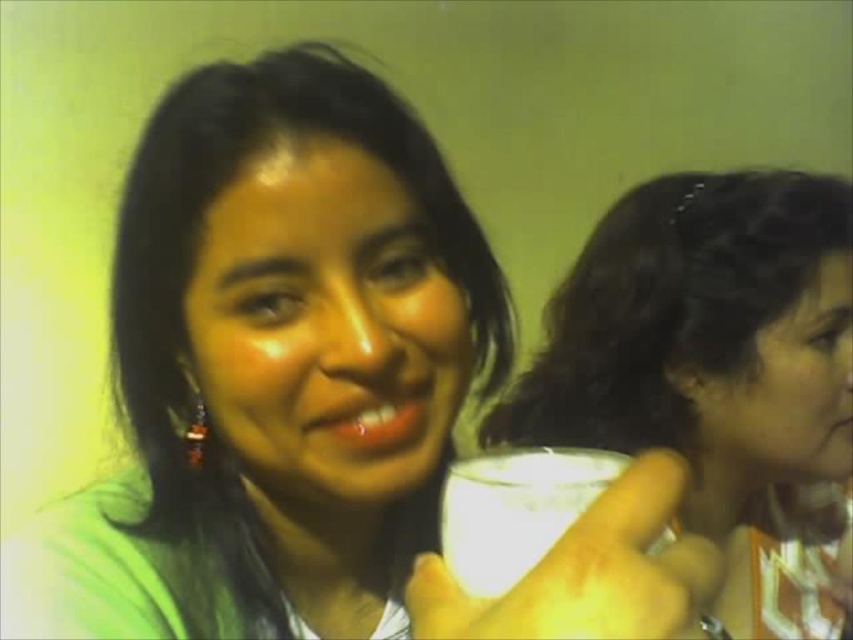
You are a barista preparing drinks for two customers. You have a matte white cup at right and a white matte cup at center on the counter. Which cup should you use if you need to serve a taller drink?

The matte white cup at right is taller than the white matte cup at center, so you should use the matte white cup at right to serve the taller drink.

You are holding a matte white cup at right and want to hand it to the person in the foreground. Can you reach them without moving your feet? The average arm length for an adult is about 25 inches.

The distance between you and the person in the foreground is 27.61 inches, which is slightly longer than the average adult arm length of 25 inches. Therefore, you might not be able to reach them without moving closer.

You are a photographer setting up for a photoshoot. You notice two cups in the scene described. Which cup, the matte white cup at right or the white matte cup at center, is closer to the camera?

The matte white cup at right is closer to the camera because the white matte cup at center is behind it.